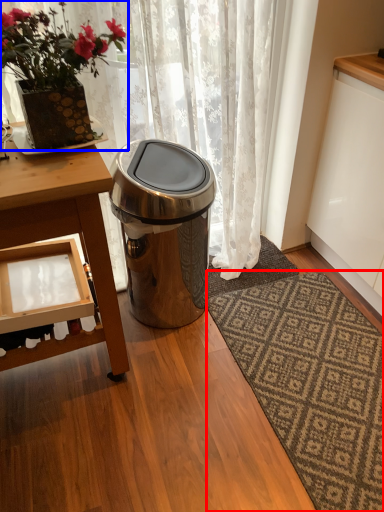
Question: Which point is closer to the camera, mat (highlighted by a red box) or houseplant (highlighted by a blue box)?

Choices:
 (A) mat
 (B) houseplant

Answer: (B)